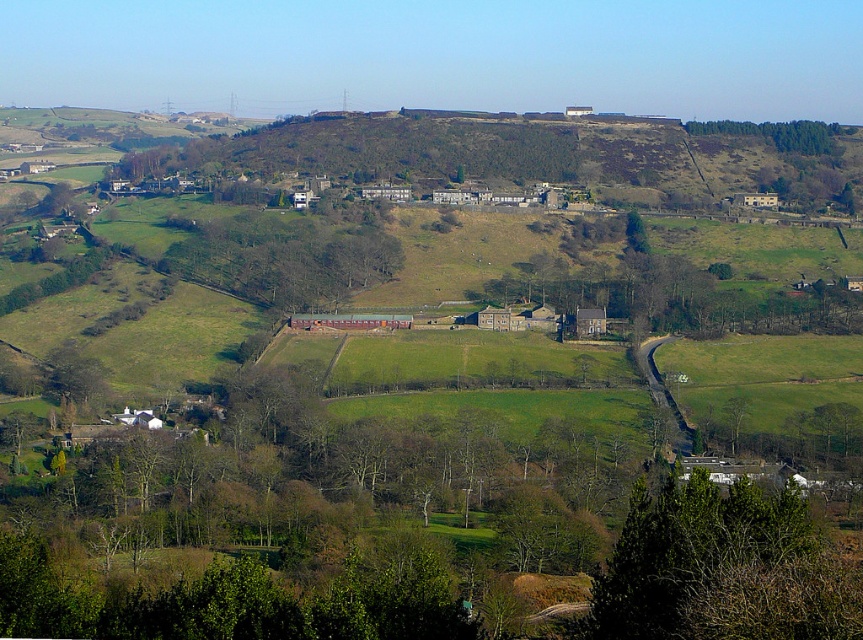
You are standing at the bottom of the image and want to walk towards the green leafy trees at upper right. Which direction should you look to see the green leafy tree at lower right?

The green leafy tree at lower right is not as tall as the green leafy trees at upper right, so you should look downward to see the green leafy tree at lower right while walking towards the upper right trees.

You are standing in the middle of the rural landscape and see the brown wooden fence at center and the green leafy trees at upper right. Which object is located to the right of the other?

The brown wooden fence at center is positioned on the left side of green leafy trees at upper right, so the green leafy trees at upper right are to the right of the brown wooden fence at center.